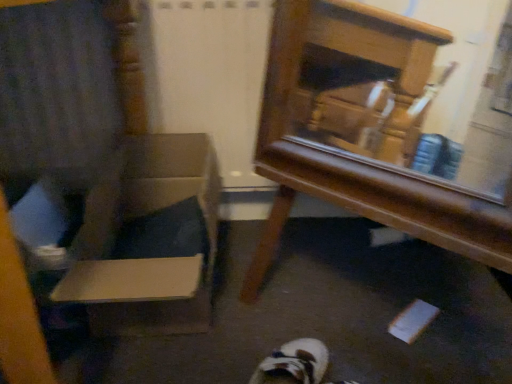
Question: Is wooden armchair at left smaller than cardboard box at left?

Choices:
 (A) yes
 (B) no

Answer: (B)

Question: Can you confirm if wooden armchair at left is bigger than cardboard box at left?

Choices:
 (A) no
 (B) yes

Answer: (B)

Question: Is wooden armchair at left behind cardboard box at left?

Choices:
 (A) yes
 (B) no

Answer: (B)

Question: Is wooden armchair at left at the right side of cardboard box at left?

Choices:
 (A) yes
 (B) no

Answer: (B)

Question: Are wooden armchair at left and cardboard box at left making contact?

Choices:
 (A) no
 (B) yes

Answer: (B)

Question: Which is correct: cardboard box at left is inside wooden armchair at left, or outside of it?

Choices:
 (A) outside
 (B) inside

Answer: (B)

Question: Considering the positions of cardboard box at left and wooden armchair at left in the image, is cardboard box at left taller or shorter than wooden armchair at left?

Choices:
 (A) short
 (B) tall

Answer: (A)

Question: Is cardboard box at left wider or thinner than wooden armchair at left?

Choices:
 (A) thin
 (B) wide

Answer: (A)

Question: In the image, is cardboard box at left positioned in front of or behind wooden armchair at left?

Choices:
 (A) behind
 (B) front

Answer: (A)

Question: Considering the positions of wooden mirror at center and wooden armchair at left in the image, is wooden mirror at center bigger or smaller than wooden armchair at left?

Choices:
 (A) small
 (B) big

Answer: (A)

Question: Is point (410, 51) closer or farther from the camera than point (126, 188)?

Choices:
 (A) closer
 (B) farther

Answer: (A)

Question: In terms of height, does wooden mirror at center look taller or shorter compared to wooden armchair at left?

Choices:
 (A) short
 (B) tall

Answer: (B)

Question: From a real-world perspective, is wooden mirror at center positioned above or below wooden armchair at left?

Choices:
 (A) above
 (B) below

Answer: (B)

Question: Based on their sizes in the image, would you say cardboard box at left is bigger or smaller than wooden mirror at center?

Choices:
 (A) big
 (B) small

Answer: (B)

Question: Is cardboard box at left inside the boundaries of wooden mirror at center, or outside?

Choices:
 (A) outside
 (B) inside

Answer: (A)